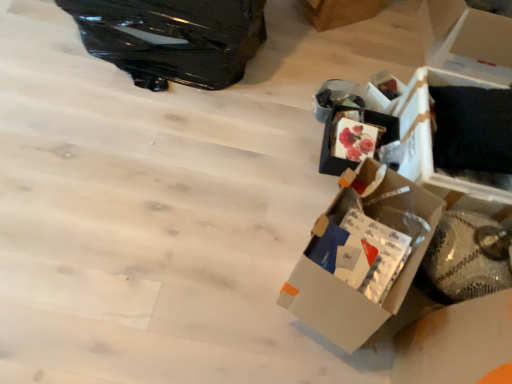
Identify the location of free space behind white cardboard box at upper right, arranged as the second storage box when viewed from the front. Image resolution: width=512 pixels, height=384 pixels. (374, 73).